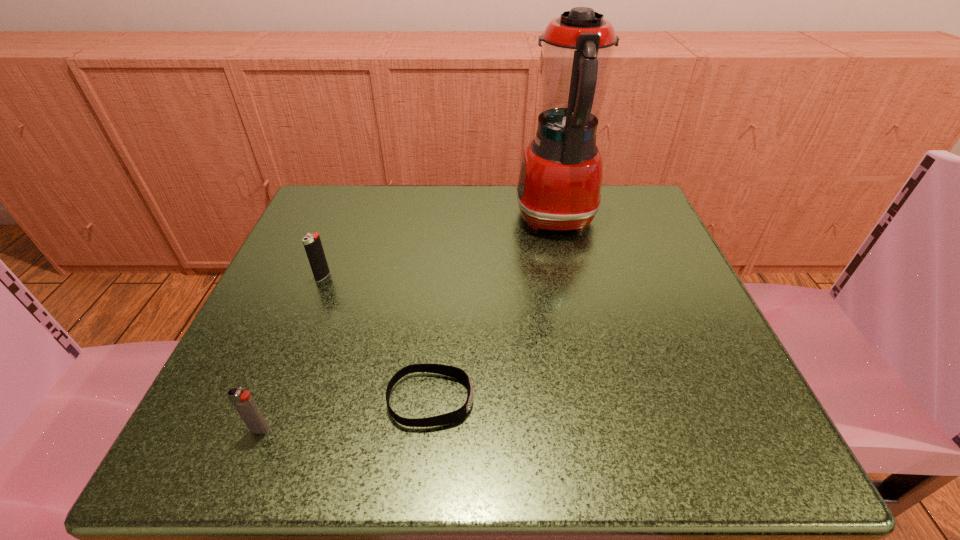
Locate an element on the screen. The width and height of the screenshot is (960, 540). empty space between the food processor and the shortest object is located at coordinates (493, 309).

This screenshot has width=960, height=540. In order to click on free spot between the second object from right to left and the nearer igniter in this screenshot , I will do `click(346, 415)`.

The image size is (960, 540). I want to click on free space between the rightmost object and the nearer igniter, so click(x=408, y=324).

The width and height of the screenshot is (960, 540). I want to click on free space between the wristband and the second farthest object, so click(376, 338).

Locate an element on the screen. Image resolution: width=960 pixels, height=540 pixels. vacant space that's between the rightmost object and the shortest object is located at coordinates pyautogui.click(x=493, y=309).

Locate an element on the screen. The image size is (960, 540). object that is the third closest to the farther igniter is located at coordinates (560, 179).

Identify which object is located as the nearest to the third object from left to right. Please provide its 2D coordinates. Your answer should be formatted as a tuple, i.e. [(x, y)], where the tuple contains the x and y coordinates of a point satisfying the conditions above.

[(243, 402)]

The width and height of the screenshot is (960, 540). Identify the location of vacant space that satisfies the following two spatial constraints: 1. on the controls of the tallest object; 2. on the front side of the nearer igniter. (603, 430).

I want to click on vacant space that satisfies the following two spatial constraints: 1. on the controls of the rightmost object; 2. on the front side of the farther igniter, so click(569, 276).